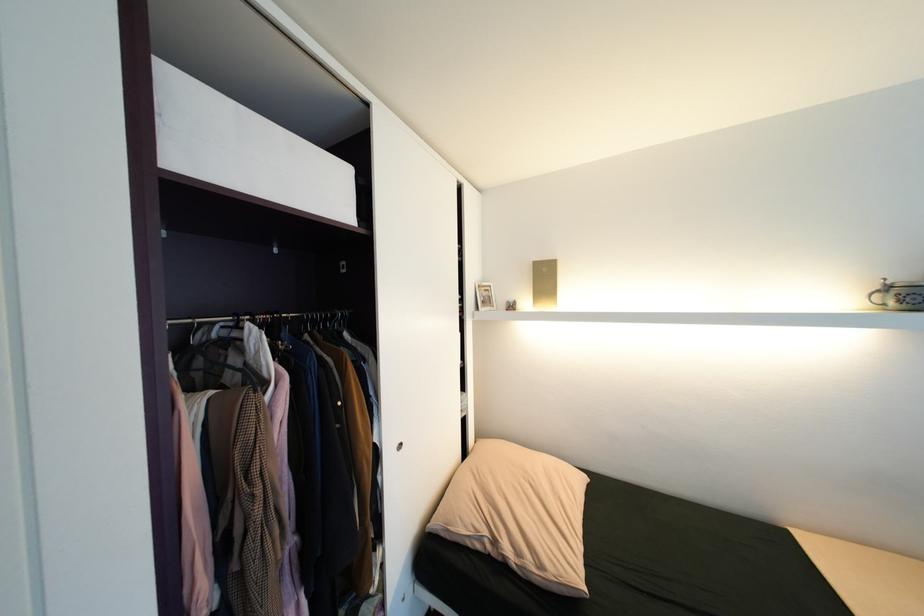
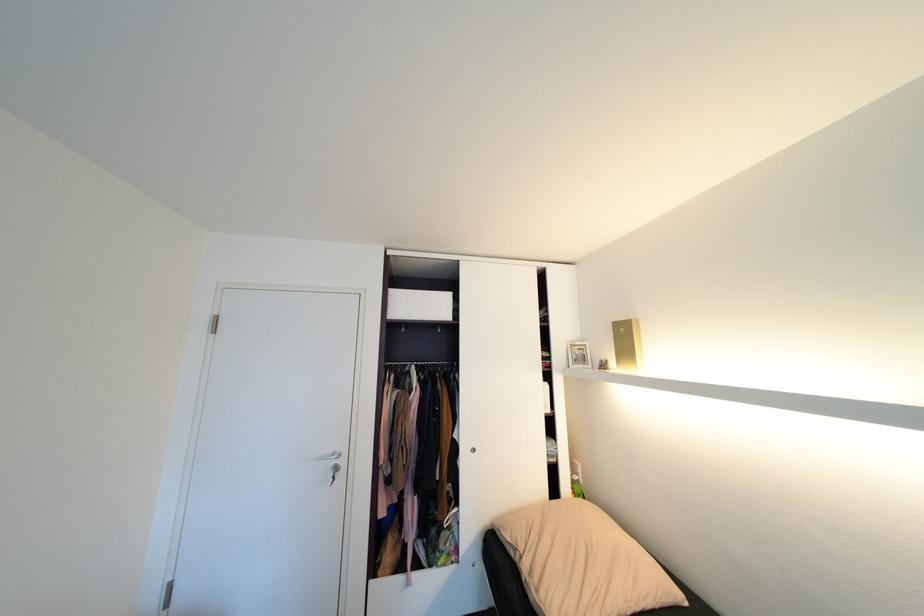
Where in the second image is the point corresponding to pixel 541 262 from the first image?

(621, 323)